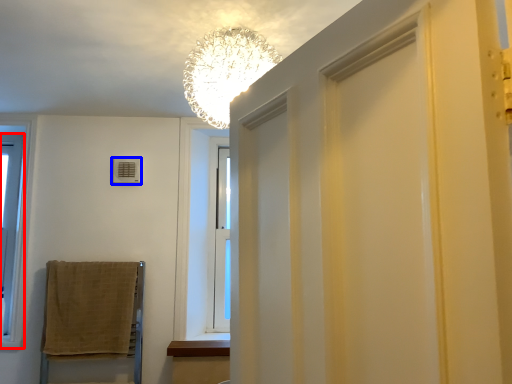
Question: Among these objects, which one is nearest to the camera, window (highlighted by a red box) or air conditioner (highlighted by a blue box)?

Choices:
 (A) window
 (B) air conditioner

Answer: (A)